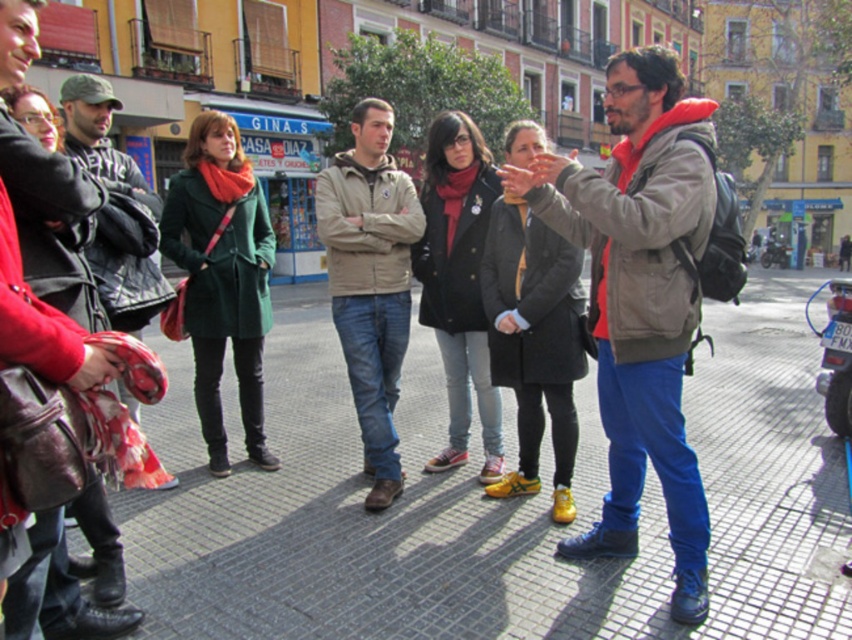
Who is higher up, gray concrete pavement at center or matte beige jacket at center?

matte beige jacket at center is above.

Does point (741, 445) come in front of point (399, 305)?

No.

In order to click on gray concrete pavement at center in this screenshot , I will do `click(488, 502)`.

Measure the distance from matte gray jacket at center to matte beige jacket at center.

matte gray jacket at center is 5.19 feet from matte beige jacket at center.

Is point (672, 330) in front of point (360, 342)?

Yes, it is in front of point (360, 342).

Between point (645, 49) and point (381, 209), which one is positioned in front?

Point (645, 49)

The height and width of the screenshot is (640, 852). Find the location of `matte gray jacket at center`. matte gray jacket at center is located at coordinates (640, 298).

Can you confirm if gray concrete pavement at center is positioned to the right of matte gray jacket at center?

Incorrect, gray concrete pavement at center is not on the right side of matte gray jacket at center.

Does gray concrete pavement at center have a lesser width compared to matte gray jacket at center?

In fact, gray concrete pavement at center might be wider than matte gray jacket at center.

Does point (730, 490) come in front of point (628, 260)?

No, (730, 490) is behind (628, 260).

Image resolution: width=852 pixels, height=640 pixels. Identify the location of gray concrete pavement at center. (488, 502).